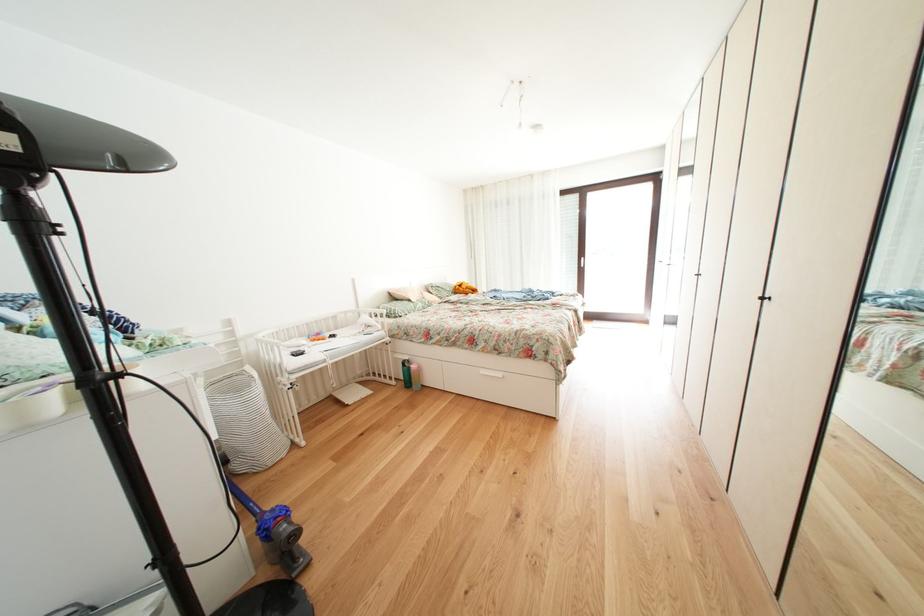
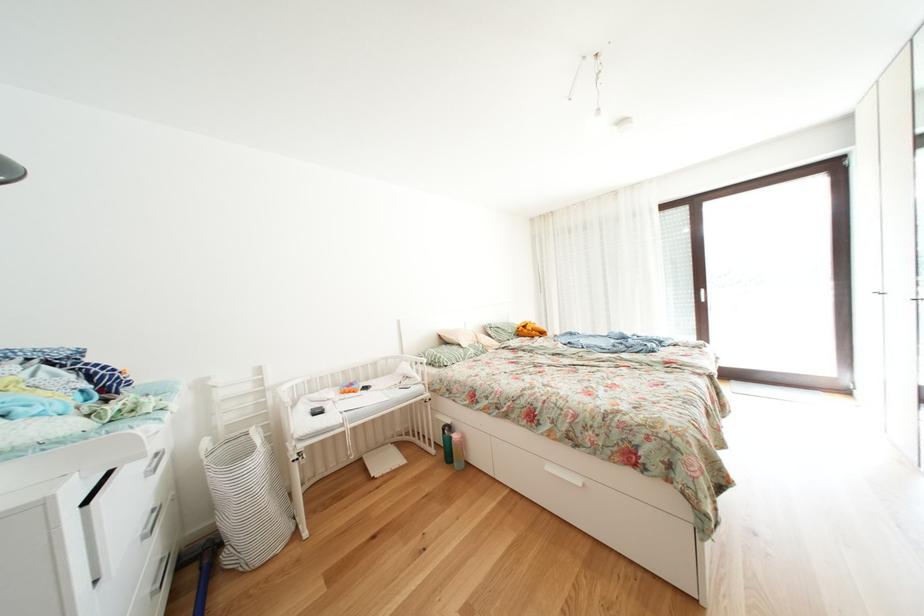
Question: How did the camera likely rotate?

Choices:
 (A) Left
 (B) Right
 (C) Up
 (D) Down

Answer: (A)